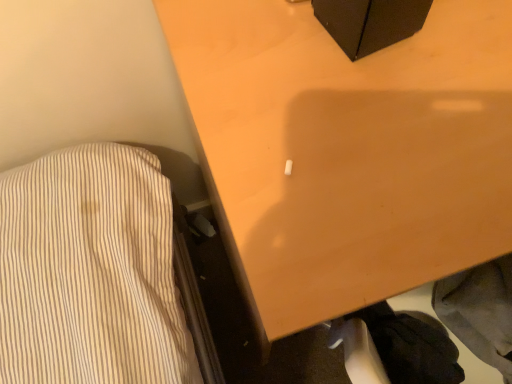
Describe the element at coordinates (348, 149) in the screenshot. The width and height of the screenshot is (512, 384). I see `wooden table at center` at that location.

You are a GUI agent. You are given a task and a screenshot of the screen. Output one action in this format:
    pyautogui.click(x=<x>, y=<y>)
    Task: Click on the wooden table at center
    The image size is (512, 384).
    Given the screenshot: What is the action you would take?
    pyautogui.click(x=348, y=149)

The image size is (512, 384). Describe the element at coordinates (406, 345) in the screenshot. I see `black fabric at lower right` at that location.

What is the approximate height of black fabric at lower right?

The height of black fabric at lower right is 10.05 centimeters.

The height and width of the screenshot is (384, 512). I want to click on black fabric at lower right, so click(x=406, y=345).

Find the location of a particular element. wooden table at center is located at coordinates (348, 149).

Between wooden table at center and black fabric at lower right, which one appears on the left side from the viewer's perspective?

black fabric at lower right is more to the left.

Is the position of wooden table at center more distant than that of black fabric at lower right?

No, wooden table at center is closer to the camera.

Which point is more forward, (243, 252) or (432, 370)?

Point (243, 252)

From the image's perspective, is wooden table at center beneath black fabric at lower right?

Actually, wooden table at center appears above black fabric at lower right in the image.

From a real-world perspective, is wooden table at center over black fabric at lower right?

No, from a real-world perspective, wooden table at center is not over black fabric at lower right

Is wooden table at center thinner than black fabric at lower right?

No, wooden table at center is not thinner than black fabric at lower right.

From the picture: Which of these two, wooden table at center or black fabric at lower right, stands taller?

With more height is wooden table at center.

Based on their sizes in the image, would you say wooden table at center is bigger or smaller than black fabric at lower right?

Clearly, wooden table at center is larger in size than black fabric at lower right.

From the picture: Does wooden table at center contain black fabric at lower right?

No, black fabric at lower right is located outside of wooden table at center.

In the scene shown: Is wooden table at center far from black fabric at lower right?

No, wooden table at center is not far from black fabric at lower right.

Could you tell me if wooden table at center is facing black fabric at lower right?

Yes, wooden table at center faces towards black fabric at lower right.

How different are the orientations of wooden table at center and black fabric at lower right in degrees?

wooden table at center and black fabric at lower right are facing 138 degrees away from each other.

How far apart are wooden table at center and black fabric at lower right?

9.38 inches.

The image size is (512, 384). I want to click on clothing below the wooden table at center (from the image's perspective), so tap(406, 345).

Between black fabric at lower right and wooden table at center, which one appears on the right side from the viewer's perspective?

wooden table at center is more to the right.

Which object is further away from the camera, black fabric at lower right or wooden table at center?

black fabric at lower right is behind.

Considering the points (420, 373) and (394, 139), which point is in front, point (420, 373) or point (394, 139)?

The point (394, 139) is more forward.

From the image's perspective, which one is positioned higher, black fabric at lower right or wooden table at center?

wooden table at center appears higher in the image.

From a real-world perspective, is black fabric at lower right physically located above or below wooden table at center?

black fabric at lower right is above wooden table at center.

Does black fabric at lower right have a greater width compared to wooden table at center?

No.

Is black fabric at lower right taller or shorter than wooden table at center?

Considering their sizes, black fabric at lower right has less height than wooden table at center.

Considering the sizes of objects black fabric at lower right and wooden table at center in the image provided, who is bigger, black fabric at lower right or wooden table at center?

With larger size is wooden table at center.

Consider the image. Would you say black fabric at lower right is inside or outside wooden table at center?

black fabric at lower right is not enclosed by wooden table at center.

Does black fabric at lower right touch wooden table at center?

No, black fabric at lower right is not making contact with wooden table at center.

Is black fabric at lower right facing away from wooden table at center?

No, wooden table at center is not at the back of black fabric at lower right.

What's the angular difference between black fabric at lower right and wooden table at center's facing directions?

There is a 138-degree angle between the facing directions of black fabric at lower right and wooden table at center.

Locate an element on the screen. This screenshot has width=512, height=384. furniture above the black fabric at lower right (from the image's perspective) is located at coordinates (348, 149).

In the image, there is a wooden table at center. Identify the location of clothing below it (from the image's perspective). (406, 345).

The image size is (512, 384). What are the coordinates of `furniture below the black fabric at lower right (from a real-world perspective)` in the screenshot? It's located at (348, 149).